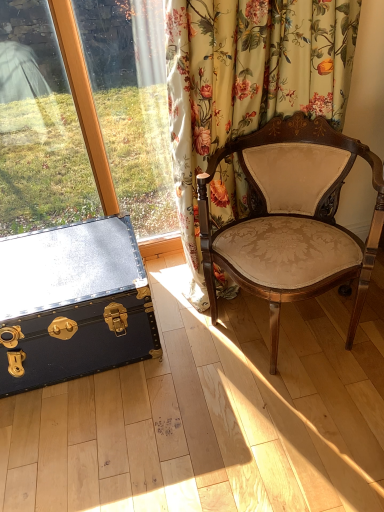
Where is `free space on the front side of floral fabric curtain at upper right`? This screenshot has height=512, width=384. free space on the front side of floral fabric curtain at upper right is located at coordinates (276, 396).